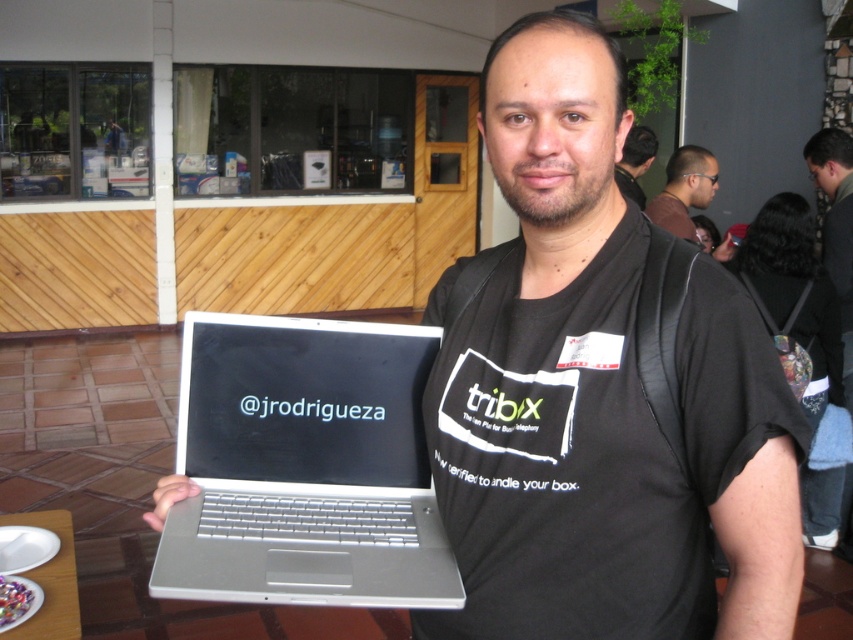
You are a photographer trying to capture the man with the laptop in the scene. The black fabric backpack at upper right is blocking part of the man. To get a clear shot, should you move left or right?

The black fabric backpack at upper right is located at point (836, 228), which is in the upper right corner of the frame. To avoid the backpack blocking the man, you should move to the left to position yourself away from the backpack.

You are a delivery person who needs to place a package that is 30 inches long on a table. The table has the black matte laptop at center and the black fabric backpack at upper right already placed on it. Can the package fit between them?

The black fabric backpack at upper right is 32.01 inches from the black matte laptop at center. Since the package is 30 inches long, it can fit between them as there is enough space.

You are organizing a backpack packing event and need to know which item takes up more space between the black fabric backpack at upper right and the matte black laptop at upper center. Which one requires more space?

The black fabric backpack at upper right is bigger than the matte black laptop at upper center, so it requires more space.